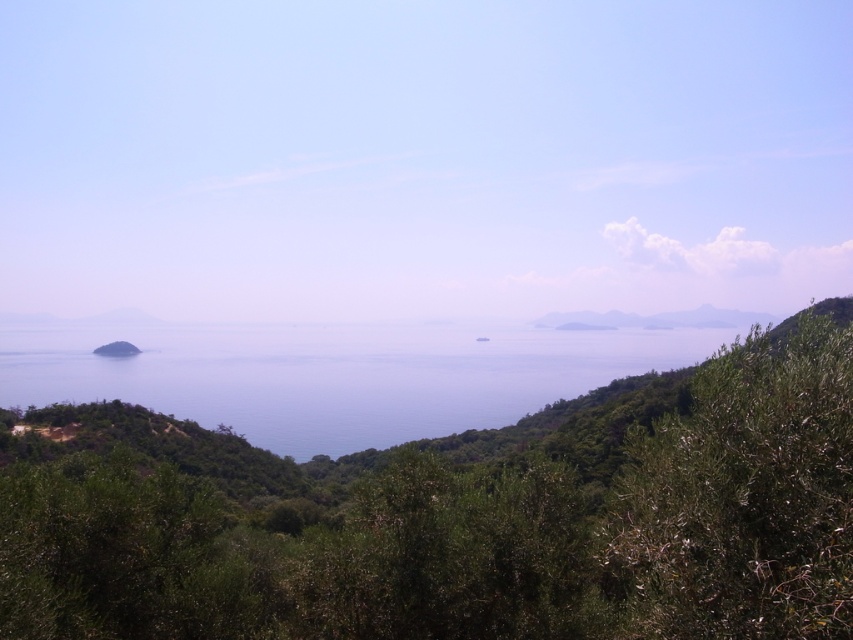
Question: Is green leafy bush at right above blue water at center?

Choices:
 (A) yes
 (B) no

Answer: (A)

Question: Which object is positioned farthest from the green leafy bush at right?

Choices:
 (A) green leafy tree at center
 (B) green matte island at lower left
 (C) green leafy mountain at center
 (D) blue water at center

Answer: (B)

Question: Is green leafy mountain at center to the left of green matte island at lower left from the viewer's perspective?

Choices:
 (A) yes
 (B) no

Answer: (B)

Question: From the image, what is the correct spatial relationship of green leafy tree at center in relation to blue water at center?

Choices:
 (A) above
 (B) below

Answer: (B)

Question: Among these points, which one is farthest from the camera?

Choices:
 (A) (498, 381)
 (B) (370, 484)
 (C) (711, 317)

Answer: (C)

Question: Which point is farther to the camera?

Choices:
 (A) (837, 362)
 (B) (125, 342)
 (C) (769, 314)

Answer: (C)